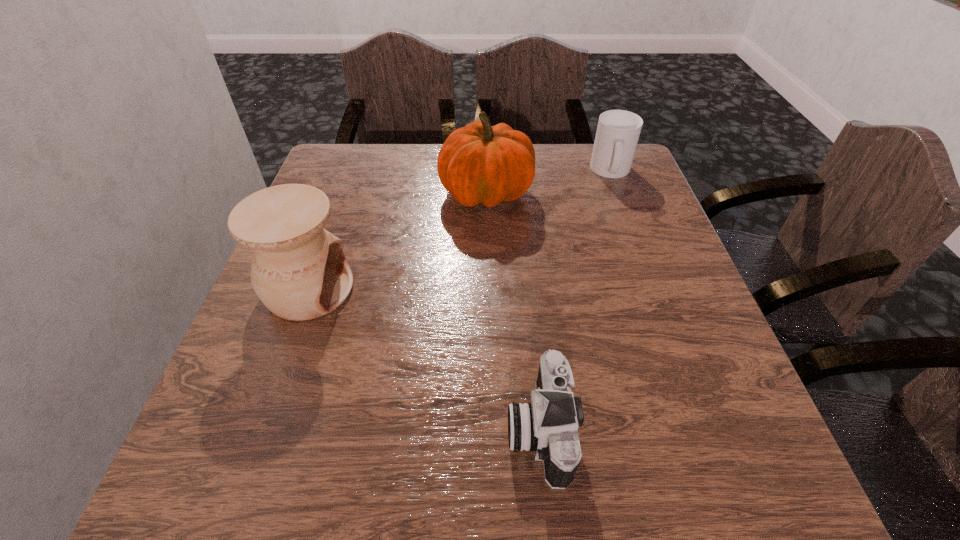
Where is `vacant space that is in between the leftmost object and the mug`? Image resolution: width=960 pixels, height=540 pixels. vacant space that is in between the leftmost object and the mug is located at coordinates (460, 230).

Locate an element on the screen. free point between the pumpkin and the leftmost object is located at coordinates (397, 241).

I want to click on free point between the mug and the pottery, so click(460, 230).

Locate an element on the screen. the closest object to the leftmost object is located at coordinates pos(479,163).

Locate which object ranks third in proximity to the mug. Please provide its 2D coordinates. Your answer should be formatted as a tuple, i.e. [(x, y)], where the tuple contains the x and y coordinates of a point satisfying the conditions above.

[(299, 271)]

Where is `free spot that satisfies the following two spatial constraints: 1. on the handle side of the second shortest object; 2. at the open side of the second nearest object`? The width and height of the screenshot is (960, 540). free spot that satisfies the following two spatial constraints: 1. on the handle side of the second shortest object; 2. at the open side of the second nearest object is located at coordinates (656, 289).

At what (x,y) coordinates should I click in order to perform the action: click on vacant area that satisfies the following two spatial constraints: 1. at the open side of the leftmost object; 2. on the back side of the camera. Please return your answer as a coordinate pair (x, y). Looking at the image, I should click on (258, 428).

Find the location of a particular element. Image resolution: width=960 pixels, height=540 pixels. free space in the image that satisfies the following two spatial constraints: 1. on the handle side of the rightmost object; 2. at the open side of the third farthest object is located at coordinates (656, 289).